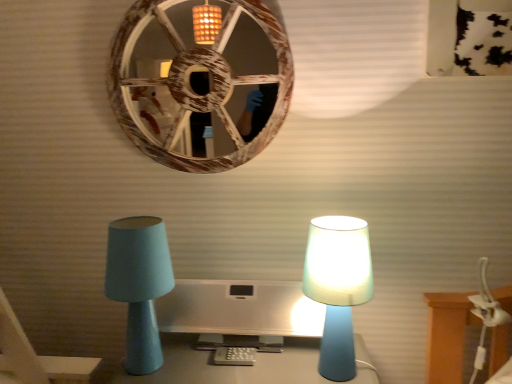
Measure the distance between point (203,96) and camera.

Point (203,96) is 1.22 meters from camera.

Find the location of a particular element. The height and width of the screenshot is (384, 512). satin silver monitor at center is located at coordinates (240, 308).

This screenshot has width=512, height=384. Identify the location of wooden wheel at upper center. (x=195, y=72).

Which is more to the left, wooden wheel at upper center or matte blue lamp at right, the second lamp when ordered from left to right?

wooden wheel at upper center is more to the left.

What's the angular difference between wooden wheel at upper center and matte blue lamp at right, the second lamp when ordered from left to right,'s facing directions?

wooden wheel at upper center and matte blue lamp at right, the second lamp when ordered from left to right, are facing 2.9 degrees away from each other.

From the image's perspective, between wooden wheel at upper center and matte blue lamp at right, the second lamp when ordered from left to right, which one is located above?

wooden wheel at upper center, from the image's perspective.

Relative to matte blue lamp at right, the second lamp when ordered from left to right, is wooden wheel at upper center in front or behind?

wooden wheel at upper center is positioned farther from the viewer than matte blue lamp at right, the second lamp when ordered from left to right.

Choose the correct answer: Is satin silver monitor at center inside matte blue lamp at right, the second lamp when ordered from left to right, or outside it?

satin silver monitor at center is spatially situated outside matte blue lamp at right, the second lamp when ordered from left to right.

Based on the photo, considering the sizes of objects satin silver monitor at center and matte blue lamp at right, the second lamp when ordered from left to right, in the image provided, who is thinner, satin silver monitor at center or matte blue lamp at right, the second lamp when ordered from left to right,?

With smaller width is matte blue lamp at right, the second lamp when ordered from left to right.

Could you tell me if satin silver monitor at center is facing matte blue lamp at right, the second lamp when ordered from left to right?

No, satin silver monitor at center is not turned towards matte blue lamp at right, the second lamp when ordered from left to right.

Is satin silver monitor at center wider or thinner than matte blue lamp at left, which is counted as the second lamp, starting from the right?

Clearly, satin silver monitor at center has more width compared to matte blue lamp at left, which is counted as the second lamp, starting from the right.

Is satin silver monitor at center not close to matte blue lamp at left, the first lamp from the left?

They are positioned close to each other.

Is satin silver monitor at center aimed at matte blue lamp at left, the first lamp from the left?

No, satin silver monitor at center is not facing towards matte blue lamp at left, the first lamp from the left.

Is matte blue lamp at right, the 1th lamp from the right, wider than wooden wheel at upper center?

Yes, matte blue lamp at right, the 1th lamp from the right, is wider than wooden wheel at upper center.

Is matte blue lamp at right, the second lamp when ordered from left to right, taller than wooden wheel at upper center?

In fact, matte blue lamp at right, the second lamp when ordered from left to right, may be shorter than wooden wheel at upper center.

Starting from the wooden wheel at upper center, which lamp is the 2nd one in front? Please provide its 2D coordinates.

[(338, 286)]

Is matte blue lamp at right, the second lamp when ordered from left to right, oriented away from wooden wheel at upper center?

matte blue lamp at right, the second lamp when ordered from left to right, does not have its back to wooden wheel at upper center.

Measure the distance between wooden wheel at upper center and satin silver monitor at center.

wooden wheel at upper center and satin silver monitor at center are 45.15 centimeters apart.

Is wooden wheel at upper center thinner than satin silver monitor at center?

Yes, wooden wheel at upper center is thinner than satin silver monitor at center.

In the scene shown: Is wooden wheel at upper center inside or outside of satin silver monitor at center?

wooden wheel at upper center is not inside satin silver monitor at center, it's outside.

Considering the positions of points (160, 10) and (229, 321), is point (160, 10) farther from camera compared to point (229, 321)?

Yes, it is behind point (229, 321).

Is matte blue lamp at left, the first lamp from the left, outside of matte blue lamp at right, the second lamp when ordered from left to right?

Yes, matte blue lamp at left, the first lamp from the left, is not within matte blue lamp at right, the second lamp when ordered from left to right.

Measure the distance from matte blue lamp at left, which is counted as the second lamp, starting from the right, to matte blue lamp at right, the 1th lamp from the right.

The distance of matte blue lamp at left, which is counted as the second lamp, starting from the right, from matte blue lamp at right, the 1th lamp from the right, is 15.96 inches.

This screenshot has height=384, width=512. Find the location of `lamp above the matte blue lamp at right, the 1th lamp from the right (from a real-world perspective)`. lamp above the matte blue lamp at right, the 1th lamp from the right (from a real-world perspective) is located at coordinates (139, 284).

Considering the sizes of objects matte blue lamp at left, which is counted as the second lamp, starting from the right, and satin silver monitor at center in the image provided, who is taller, matte blue lamp at left, which is counted as the second lamp, starting from the right, or satin silver monitor at center?

matte blue lamp at left, which is counted as the second lamp, starting from the right, is taller.

Could you tell me if matte blue lamp at left, which is counted as the second lamp, starting from the right, is turned towards satin silver monitor at center?

No, matte blue lamp at left, which is counted as the second lamp, starting from the right, is not oriented towards satin silver monitor at center.

Could satin silver monitor at center be considered to be inside matte blue lamp at left, the first lamp from the left?

No.

Where is `lamp on the right of wooden wheel at upper center`? This screenshot has height=384, width=512. lamp on the right of wooden wheel at upper center is located at coordinates (338, 286).

Locate an element on the screen. The width and height of the screenshot is (512, 384). computer monitor lying below the matte blue lamp at right, the second lamp when ordered from left to right (from the image's perspective) is located at coordinates (240, 308).

Which object lies further to the anchor point satin silver monitor at center, matte blue lamp at left, the first lamp from the left, or matte blue lamp at right, the 1th lamp from the right?

matte blue lamp at right, the 1th lamp from the right, lies further to satin silver monitor at center than the other object.

Considering their positions, is wooden wheel at upper center positioned further to matte blue lamp at left, the first lamp from the left, than satin silver monitor at center?

The object further to matte blue lamp at left, the first lamp from the left, is wooden wheel at upper center.

Looking at the image, which one is located closer to satin silver monitor at center, matte blue lamp at right, the 1th lamp from the right, or wooden wheel at upper center?

Among the two, matte blue lamp at right, the 1th lamp from the right, is located nearer to satin silver monitor at center.

When comparing their distances from wooden wheel at upper center, does matte blue lamp at right, the 1th lamp from the right, or matte blue lamp at left, which is counted as the second lamp, starting from the right, seem closer?

The object closer to wooden wheel at upper center is matte blue lamp at left, which is counted as the second lamp, starting from the right.

When comparing their distances from matte blue lamp at right, the 1th lamp from the right, does wooden wheel at upper center or matte blue lamp at left, the first lamp from the left, seem further?

Based on the image, wooden wheel at upper center appears to be further to matte blue lamp at right, the 1th lamp from the right.

Looking at the image, which one is located further to matte blue lamp at right, the second lamp when ordered from left to right, wooden wheel at upper center or satin silver monitor at center?

The object further to matte blue lamp at right, the second lamp when ordered from left to right, is wooden wheel at upper center.

Based on their spatial positions, is satin silver monitor at center or matte blue lamp at right, the second lamp when ordered from left to right, further from wooden wheel at upper center?

Among the two, matte blue lamp at right, the second lamp when ordered from left to right, is located further to wooden wheel at upper center.

Looking at the image, which one is located further to matte blue lamp at right, the second lamp when ordered from left to right, matte blue lamp at left, which is counted as the second lamp, starting from the right, or wooden wheel at upper center?

wooden wheel at upper center lies further to matte blue lamp at right, the second lamp when ordered from left to right, than the other object.

In order to click on computer monitor located between matte blue lamp at left, the first lamp from the left, and matte blue lamp at right, the 1th lamp from the right, in the left-right direction in this screenshot , I will do `click(240, 308)`.

I want to click on lamp between wooden wheel at upper center and matte blue lamp at right, the 1th lamp from the right, vertically, so click(139, 284).